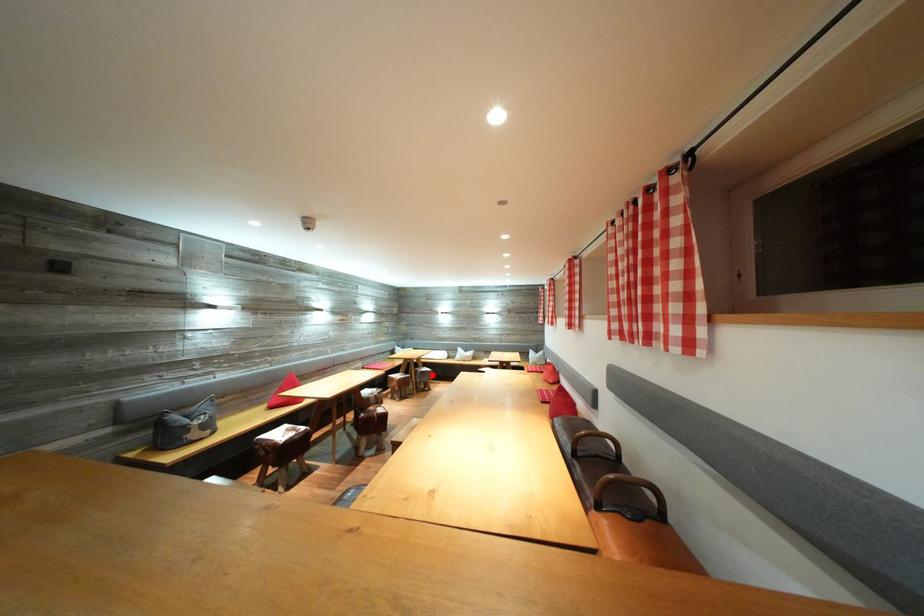
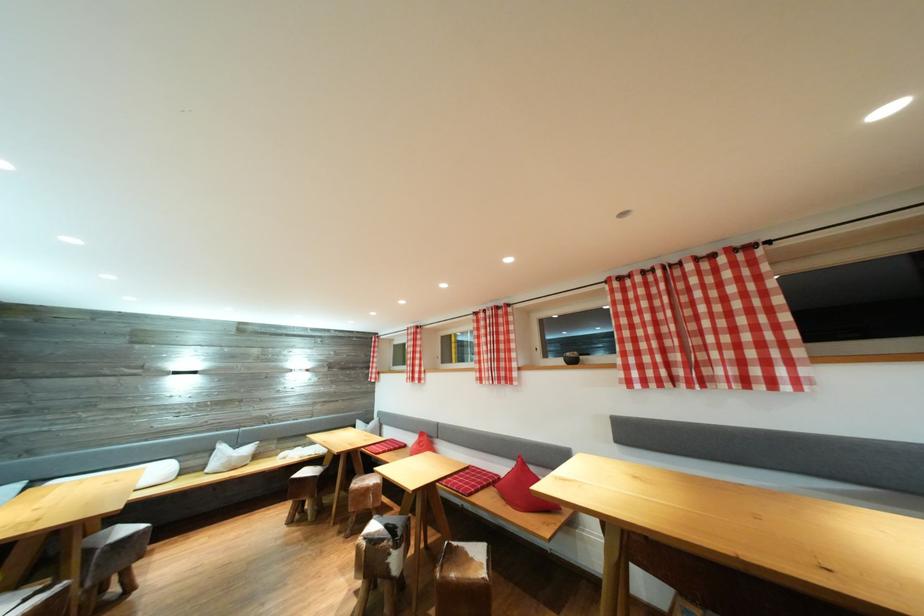
Question: A red point is marked in image1. In image2, is the corresponding 3D point closer to the camera or farther? Reply with the corresponding letter.

Choices:
 (A) The corresponding 3D point is closer.
 (B) The corresponding 3D point is farther.

Answer: (A)